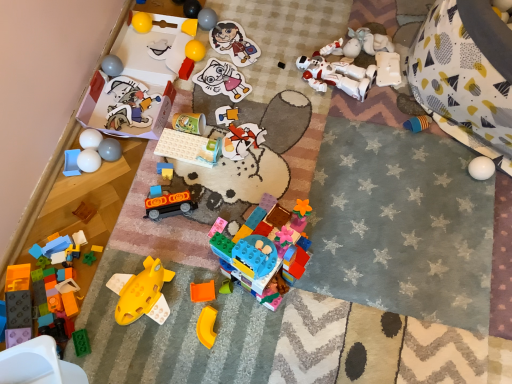
The width and height of the screenshot is (512, 384). I want to click on vacant space in front of matte paper sticker at center, which appears as the 6th toy when viewed from the right, so click(233, 127).